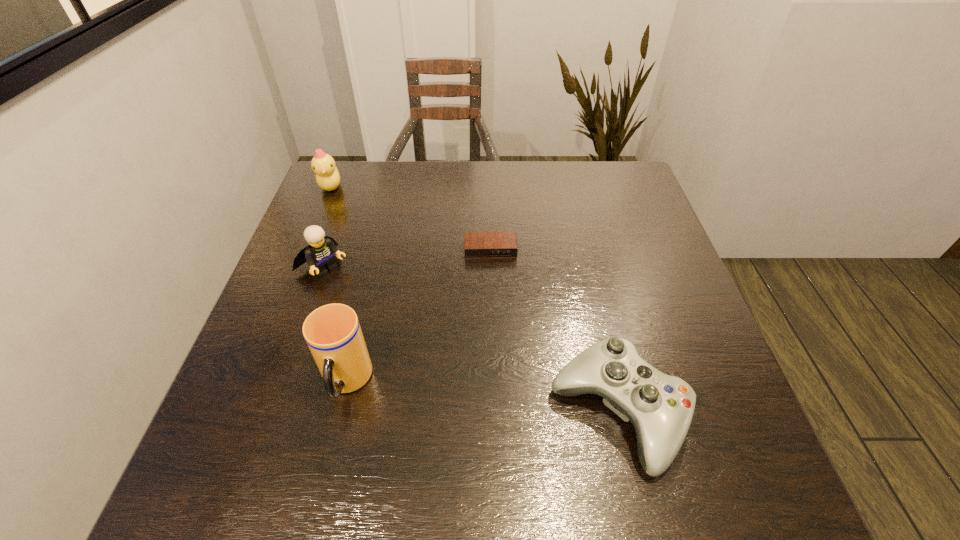
Identify the location of object that can be found as the third closest to the farthest object. pos(332,332).

Find the location of `object that is the second closest one to the alarm clock`. object that is the second closest one to the alarm clock is located at coordinates coord(660,407).

I want to click on free spot that satisfies the following two spatial constraints: 1. on the front side of the Lego; 2. on the right side of the duckling, so click(299, 266).

Locate an element on the screen. The image size is (960, 540). vacant region that satisfies the following two spatial constraints: 1. on the side of the third object from right to left with the handle; 2. on the left side of the rightmost object is located at coordinates (340, 413).

Locate an element on the screen. The width and height of the screenshot is (960, 540). vacant region that satisfies the following two spatial constraints: 1. on the front side of the Lego; 2. on the right side of the duckling is located at coordinates (299, 266).